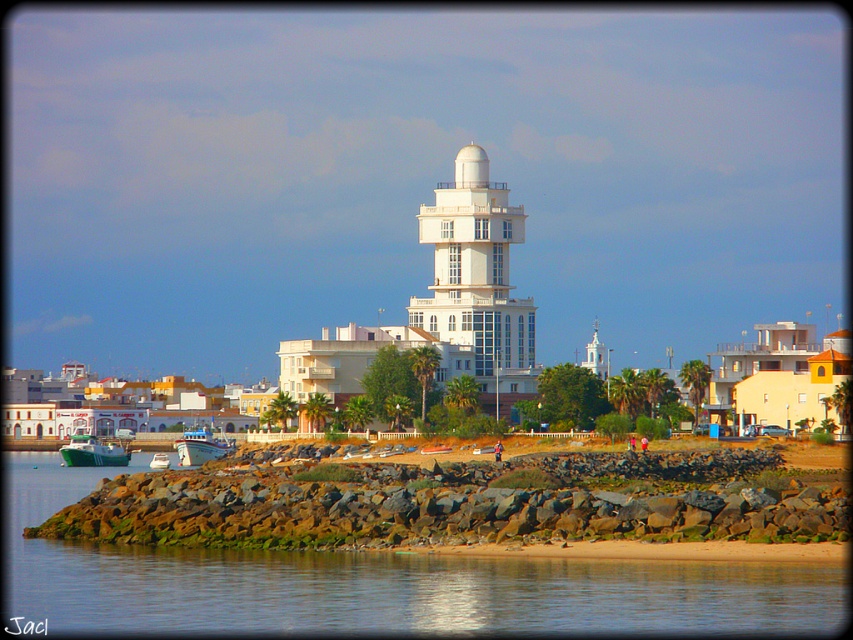
You are a tour guide leading a group to the green matte boat at lower left from the white glossy tower at center. The group can walk 100 feet per minute. How many minutes will it take them to reach the boat?

The distance between the white glossy tower at center and the green matte boat at lower left is 147.85 feet. Since the group walks at 100 feet per minute, it will take approximately 1.48 minutes to reach the boat.

You are a photographer planning to take a photo of the white glossy tower at center. You want to ensure the green stone wall at lower center is visible in the foreground. Based on their positions, is this possible?

The green stone wall at lower center is positioned under the white glossy tower at center, so yes, it will naturally appear in the foreground of the photo.